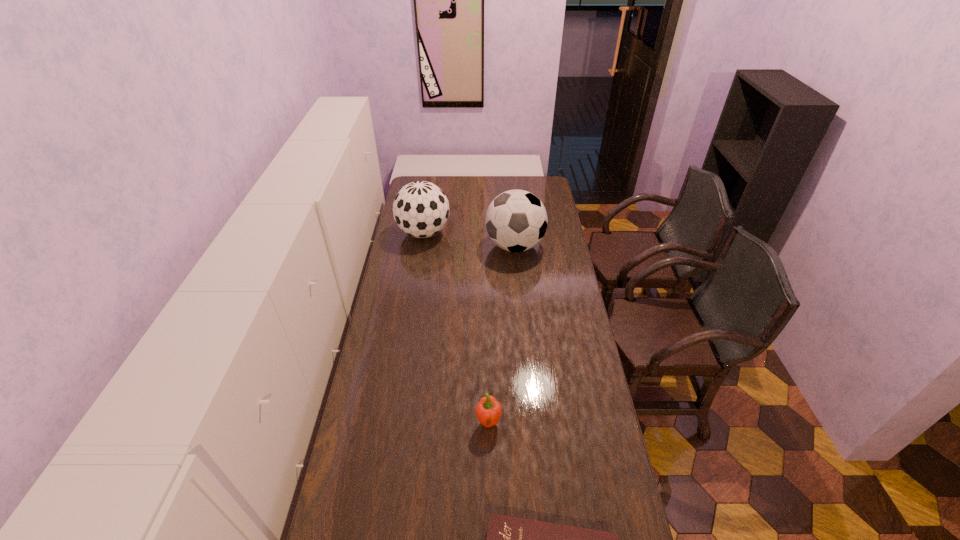
Identify the location of free space that satisfies the following two spatial constraints: 1. on the main logo of the right soccer ball; 2. on the front side of the second nearest object. Image resolution: width=960 pixels, height=540 pixels. (531, 422).